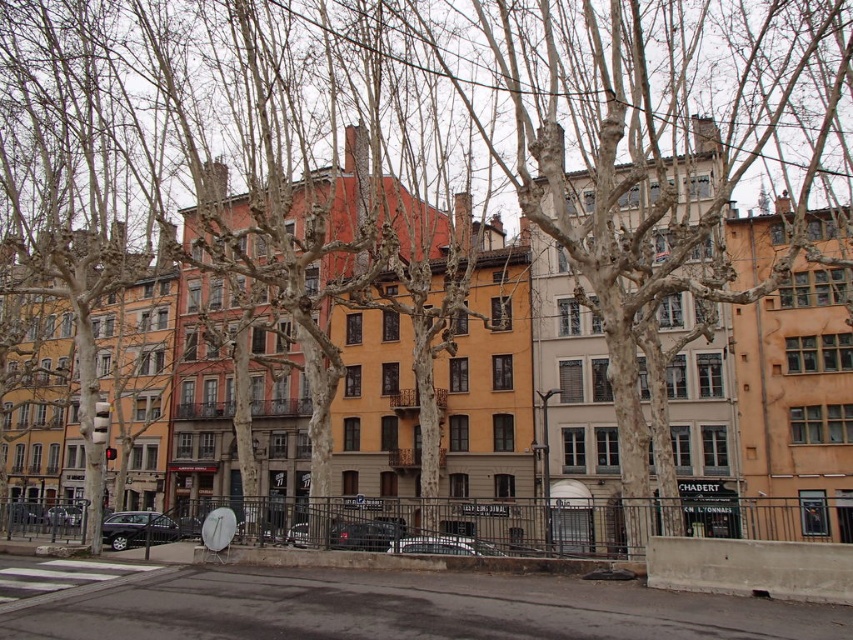
Question: Does shiny black sedan at lower left appear on the left side of shiny black car at center?

Choices:
 (A) yes
 (B) no

Answer: (A)

Question: In this image, where is metallic silver car at center located relative to matte black car at lower left?

Choices:
 (A) below
 (B) above

Answer: (B)

Question: Observing the image, what is the correct spatial positioning of metallic silver car at center in reference to matte black car at lower left?

Choices:
 (A) right
 (B) left

Answer: (A)

Question: Which of the following is the closest to the observer?

Choices:
 (A) shiny black sedan at lower left
 (B) metallic silver car at center
 (C) matte black car at lower left
 (D) shiny black car at center

Answer: (B)

Question: Which point appears farthest from the camera in this image?

Choices:
 (A) [x=340, y=545]
 (B) [x=59, y=518]
 (C) [x=477, y=554]

Answer: (B)

Question: Which of these objects is positioned farthest from the shiny black sedan at lower left?

Choices:
 (A) metallic silver car at center
 (B) matte black car at lower left
 (C) shiny black car at center

Answer: (A)